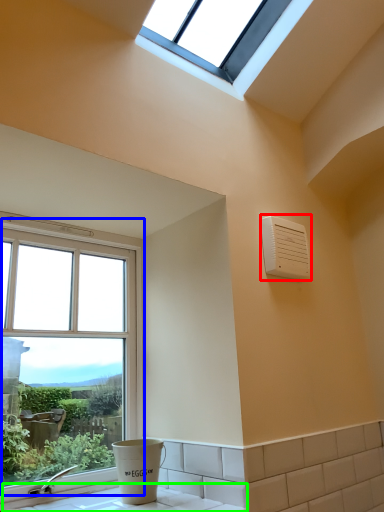
Question: Based on their relative distances, which object is nearer to air conditioning (highlighted by a red box)? Choose from window (highlighted by a blue box) and counter top (highlighted by a green box).

Choices:
 (A) window
 (B) counter top

Answer: (A)